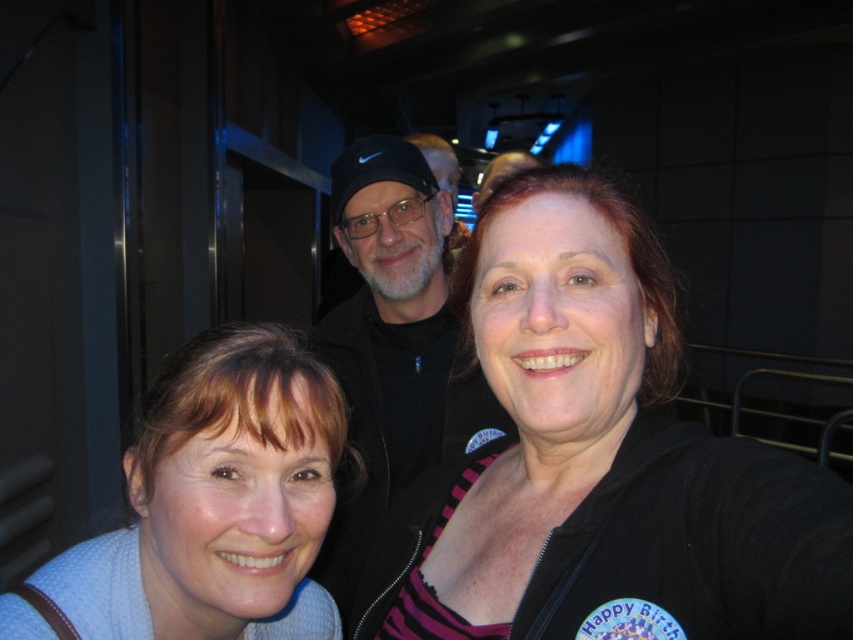
You are standing in the same room as the photo and want to move from the point at coordinate [625,464] to the point at coordinate [271,570]. Which direction should you move to get closer to the camera?

To move closer to the camera from point [625,464] to point [271,570], you should move towards the point at coordinate [271,570] since it is closer to the camera than point [625,464].

You are a photographer holding a camera. You want to take a photo of the blue knit sweater at lower left. Can you reach the sweater without moving your feet?

The blue knit sweater at lower left and camera are 20.60 inches apart, so yes, the photographer can reach the sweater without moving their feet since the distance is within arm reach.

You are at a social event and see two black items at the center of the image. The items are the black matte jacket at center and the black fabric at center. Which one is positioned to the right?

The black matte jacket at center is positioned to the right of the black fabric at center.